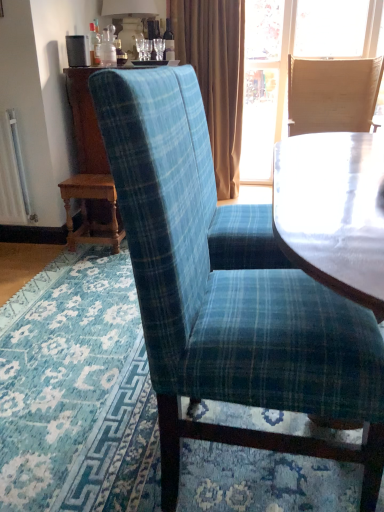
At what (x,y) coordinates should I click in order to perform the action: click on free location in front of wooden table at lower left. Please return your answer as a coordinate pair (x, y). The width and height of the screenshot is (384, 512). Looking at the image, I should click on [x=72, y=263].